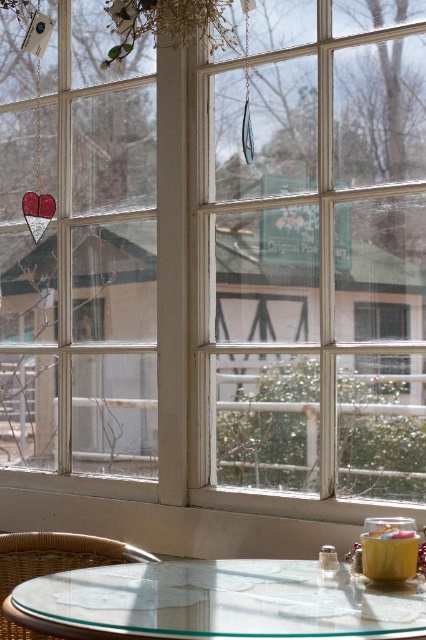
Question: Is transparent glass table at lower center thinner than rattan chair at lower left?

Choices:
 (A) no
 (B) yes

Answer: (A)

Question: Is transparent glass table at lower center positioned before rattan chair at lower left?

Choices:
 (A) no
 (B) yes

Answer: (B)

Question: Can you confirm if transparent glass table at lower center is positioned below rattan chair at lower left?

Choices:
 (A) yes
 (B) no

Answer: (B)